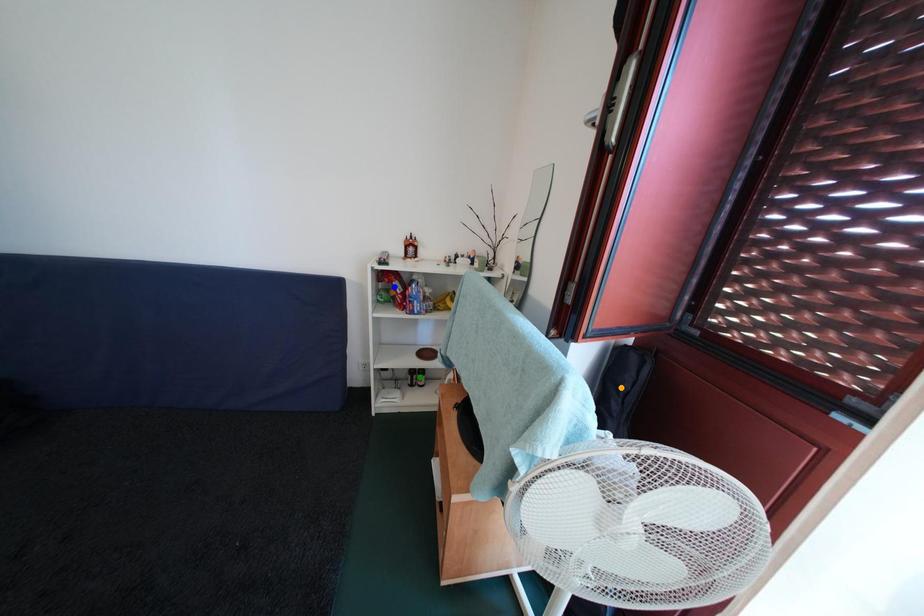
In the scene shown: Order these from nearest to farthest:
green point
orange point
blue point

orange point
blue point
green point